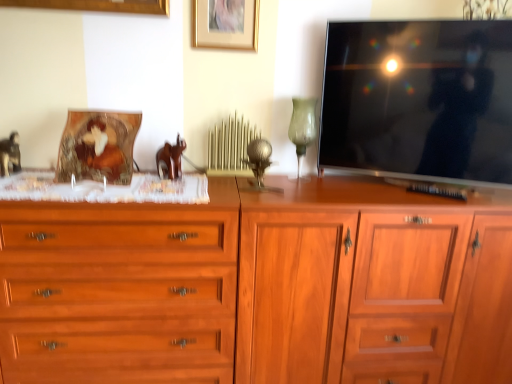
Find the location of a particular element. vacant area located to the right-hand side of metallic silver table lamp at center, marked as the first table lamp in a left-to-right arrangement is located at coordinates (302, 188).